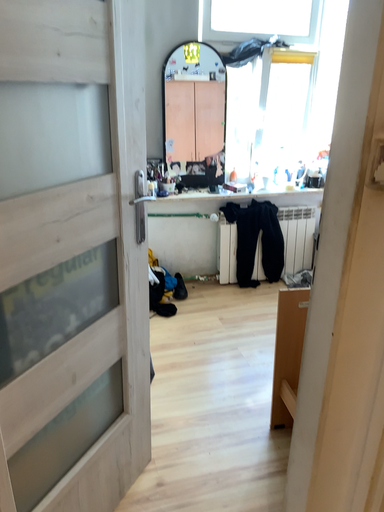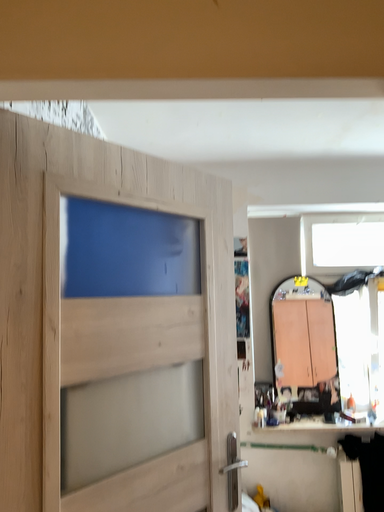
Question: How did the camera likely rotate when shooting the video?

Choices:
 (A) rotated upward
 (B) rotated downward

Answer: (A)